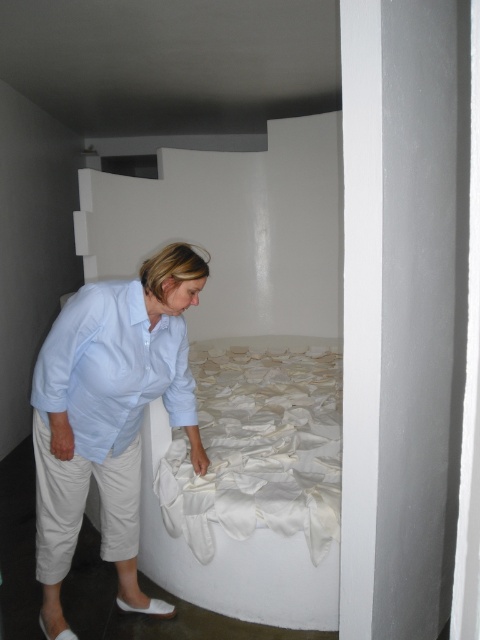
Question: Which point appears closest to the camera in this image?

Choices:
 (A) pyautogui.click(x=191, y=324)
 (B) pyautogui.click(x=88, y=372)

Answer: (B)

Question: Is light blue shirt at center below white satin sheet at center?

Choices:
 (A) yes
 (B) no

Answer: (B)

Question: Can you confirm if white satin sheet at center is positioned below light blue cotton shirt at lower left?

Choices:
 (A) no
 (B) yes

Answer: (B)

Question: Estimate the real-world distances between objects in this image. Which object is closer to the white fabric bed at center?

Choices:
 (A) light blue cotton shirt at lower left
 (B) light blue shirt at center

Answer: (A)

Question: Observing the image, what is the correct spatial positioning of white fabric bed at center in reference to light blue shirt at center?

Choices:
 (A) below
 (B) above

Answer: (B)

Question: Which object is positioned closest to the white fabric bed at center?

Choices:
 (A) light blue shirt at center
 (B) white satin sheet at center

Answer: (B)